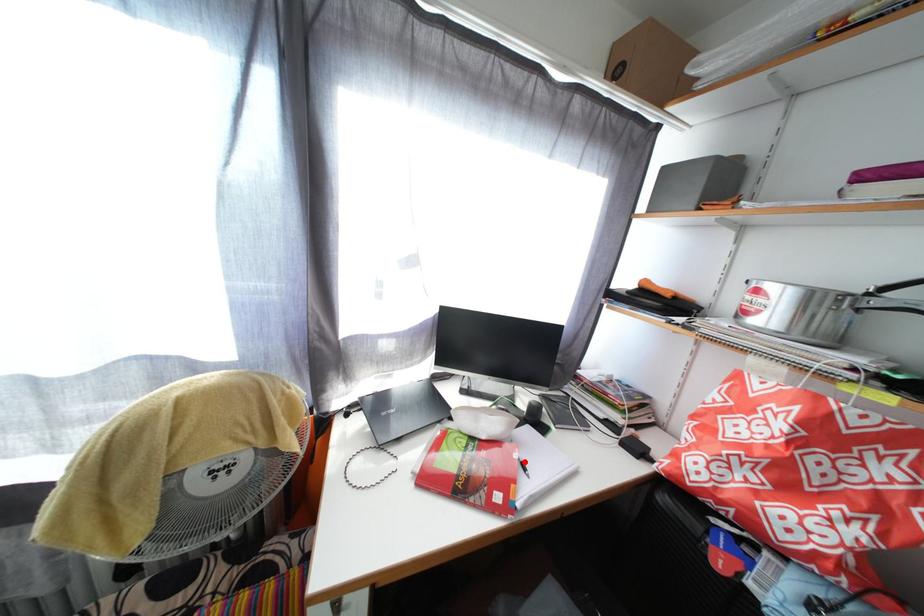
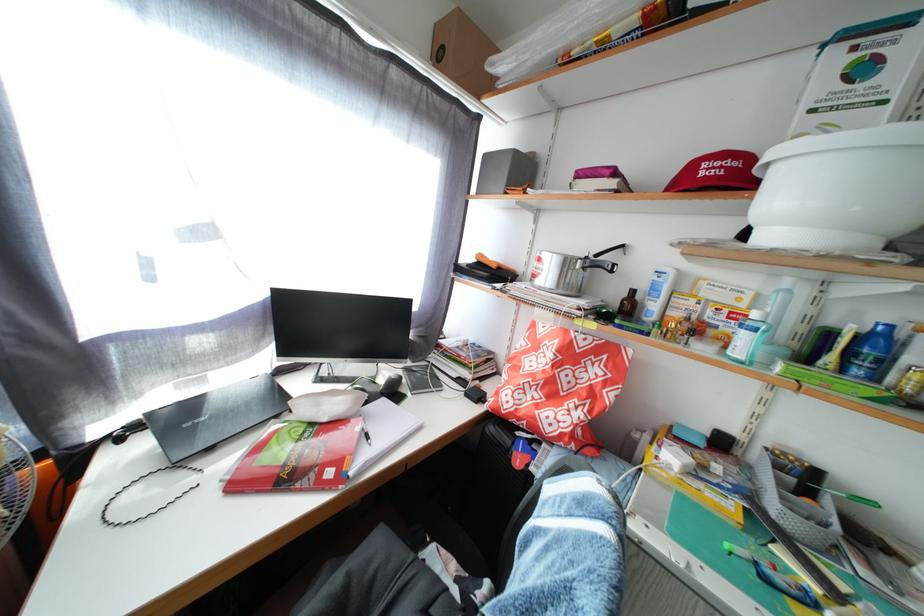
Where in the second image is the point corresponding to the highlighted location from the first image?

(367, 435)